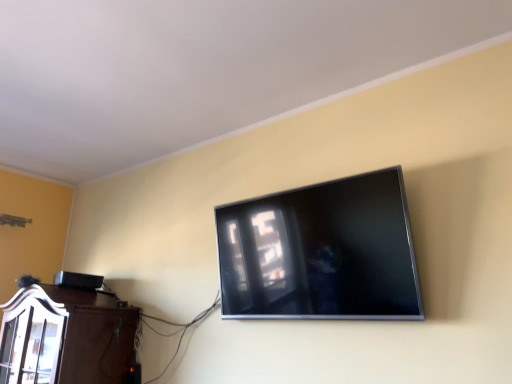
Question: Does brown wood cabinet at lower left have a greater height compared to satin black tv at upper center?

Choices:
 (A) no
 (B) yes

Answer: (A)

Question: Is brown wood cabinet at lower left far away from satin black tv at upper center?

Choices:
 (A) no
 (B) yes

Answer: (B)

Question: Can you confirm if brown wood cabinet at lower left is smaller than satin black tv at upper center?

Choices:
 (A) yes
 (B) no

Answer: (B)

Question: From the image's perspective, would you say brown wood cabinet at lower left is shown under satin black tv at upper center?

Choices:
 (A) no
 (B) yes

Answer: (B)

Question: From a real-world perspective, is brown wood cabinet at lower left over satin black tv at upper center?

Choices:
 (A) yes
 (B) no

Answer: (B)

Question: From a real-world perspective, is brown wood cabinet at lower left below satin black tv at upper center?

Choices:
 (A) yes
 (B) no

Answer: (A)

Question: Does satin black tv at upper center have a greater width compared to brown wood cabinet at lower left?

Choices:
 (A) no
 (B) yes

Answer: (A)

Question: From the image's perspective, is satin black tv at upper center below brown wood cabinet at lower left?

Choices:
 (A) yes
 (B) no

Answer: (B)

Question: Are satin black tv at upper center and brown wood cabinet at lower left far apart?

Choices:
 (A) yes
 (B) no

Answer: (A)

Question: Does satin black tv at upper center have a lesser height compared to brown wood cabinet at lower left?

Choices:
 (A) yes
 (B) no

Answer: (B)

Question: Is satin black tv at upper center turned away from brown wood cabinet at lower left?

Choices:
 (A) no
 (B) yes

Answer: (A)

Question: Is brown wood cabinet at lower left inside satin black tv at upper center?

Choices:
 (A) yes
 (B) no

Answer: (B)

Question: In the image, is brown wood cabinet at lower left positioned in front of or behind satin black tv at upper center?

Choices:
 (A) front
 (B) behind

Answer: (B)